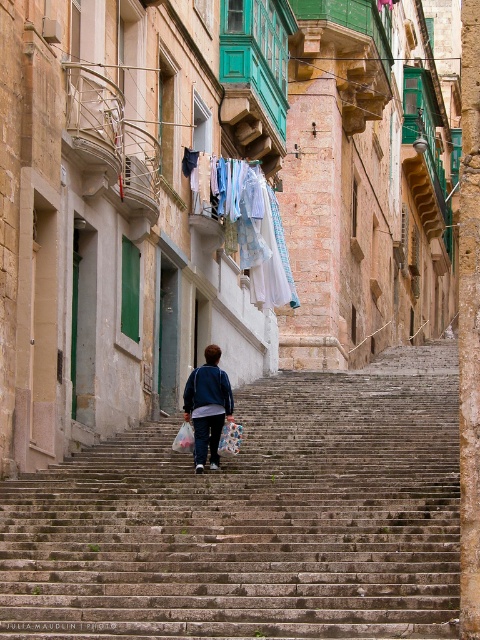
In the scene shown: Between light blue fabric at upper center and blue fleece jacket at center, which one appears on the right side from the viewer's perspective?

From the viewer's perspective, light blue fabric at upper center appears more on the right side.

Who is more distant from viewer, (260,186) or (214,365)?

Positioned behind is point (260,186).

Is point (260, 189) positioned behind point (201, 397)?

Yes, point (260, 189) is farther from viewer.

The height and width of the screenshot is (640, 480). Identify the location of light blue fabric at upper center. (255, 228).

Is stone stairs at center below blue fleece jacket at center?

Yes.

Does point (324, 456) come closer to viewer compared to point (215, 426)?

No, (324, 456) is behind (215, 426).

Locate an element on the screen. This screenshot has width=480, height=640. stone stairs at center is located at coordinates (254, 518).

The width and height of the screenshot is (480, 640). In order to click on stone stairs at center in this screenshot , I will do `click(254, 518)`.

Between blue fleece jacket at center and plastic bag at center, which one is positioned lower?

plastic bag at center is below.

Does blue fleece jacket at center come behind plastic bag at center?

No, blue fleece jacket at center is in front of plastic bag at center.

Is point (222, 417) positioned in front of point (228, 444)?

No.

Find the location of a particular element. blue fleece jacket at center is located at coordinates (207, 406).